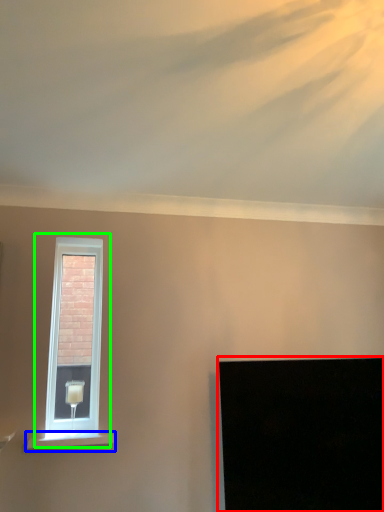
Question: Based on their relative distances, which object is farther from computer screen (highlighted by a red box)? Choose from window sill (highlighted by a blue box) and window (highlighted by a green box).

Choices:
 (A) window sill
 (B) window

Answer: (B)